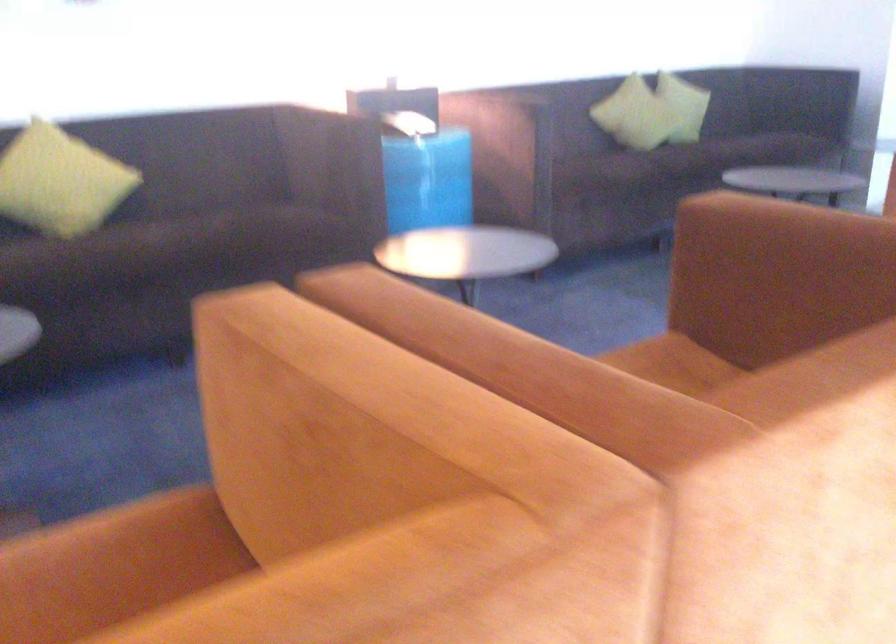
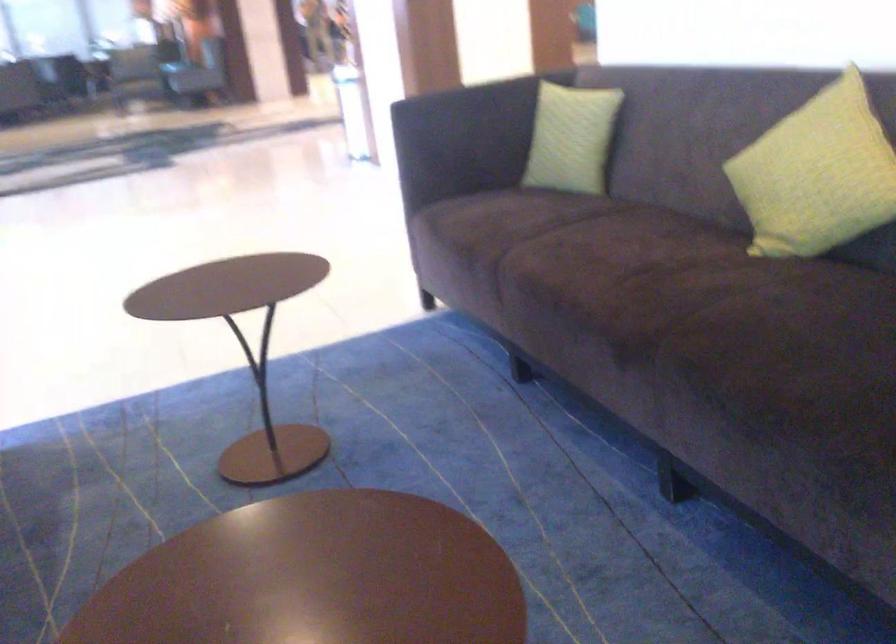
Where in the second image is the point corresponding to point (84, 176) from the first image?

(816, 174)